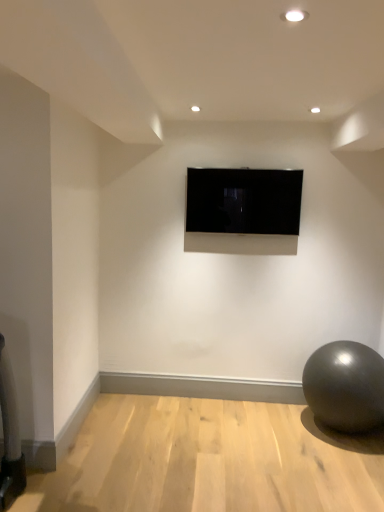
Where is `free space that is to the left of shiny metallic ball at lower right`? The image size is (384, 512). free space that is to the left of shiny metallic ball at lower right is located at coordinates (282, 435).